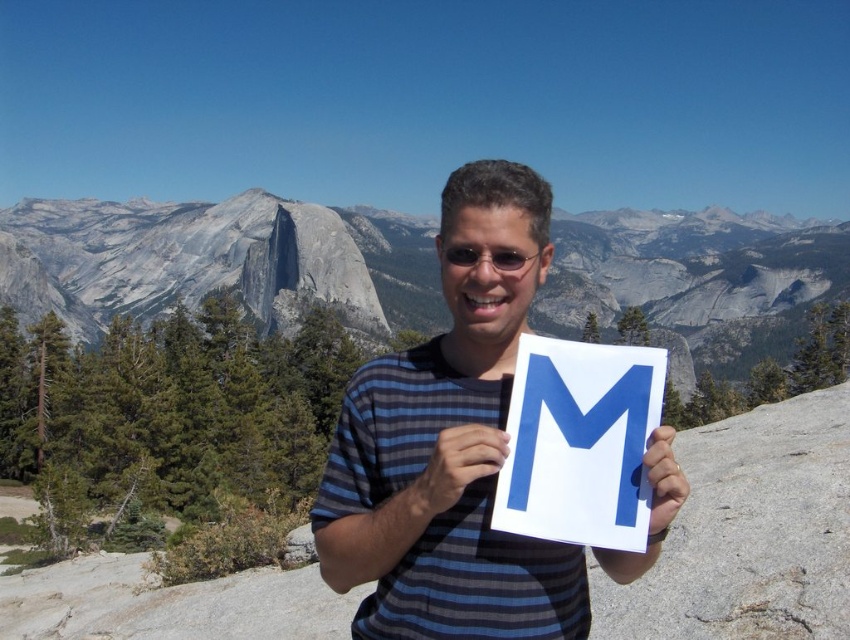
Question: Which point is farther to the camera?

Choices:
 (A) white matte paper at center
 (B) blue paper sign at center

Answer: (B)

Question: Which of the following is the closest to the observer?

Choices:
 (A) matte plastic goggles at center
 (B) gray rock at center
 (C) white matte paper at center

Answer: (C)

Question: Does gray rock at center have a larger size compared to white paper at center?

Choices:
 (A) yes
 (B) no

Answer: (A)

Question: Does blue paper letter m at center appear on the right side of white paper at center?

Choices:
 (A) no
 (B) yes

Answer: (A)

Question: Does blue paper letter m at center appear on the right side of white paper at center?

Choices:
 (A) yes
 (B) no

Answer: (B)

Question: Among these objects, which one is farthest from the camera?

Choices:
 (A) blue paper letter m at center
 (B) gray rock at center
 (C) white matte paper at center

Answer: (B)